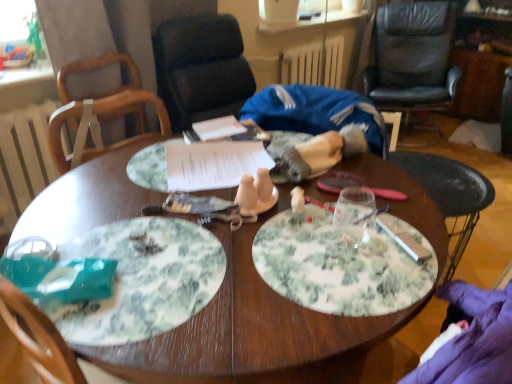
Locate an element on the screen. Image resolution: width=512 pixels, height=384 pixels. blank space above green floral plate at center, which appears as the second plate when viewed from the back (from a real-world perspective) is located at coordinates (137, 266).